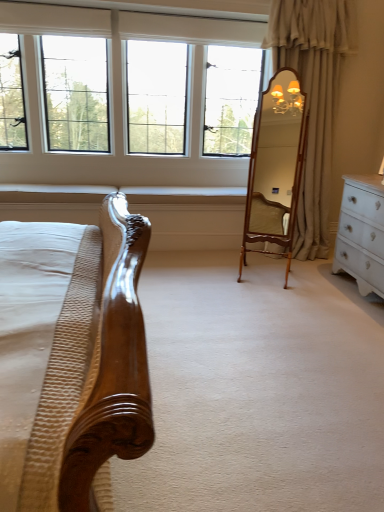
This screenshot has width=384, height=512. What are the coordinates of `clear glass windows at upper center` in the screenshot? It's located at (121, 99).

Find the location of a particular element. clear glass windows at upper center is located at coordinates (121, 99).

Is wooden mirror at center directly adjacent to clear glass windows at upper center?

wooden mirror at center and clear glass windows at upper center are clearly separated.

Considering the relative sizes of wooden mirror at center and clear glass windows at upper center in the image provided, is wooden mirror at center bigger than clear glass windows at upper center?

Incorrect, wooden mirror at center is not larger than clear glass windows at upper center.

From a real-world perspective, who is located higher, wooden mirror at center or clear glass windows at upper center?

clear glass windows at upper center.

Choose the correct answer: Is wooden mirror at center inside clear glass windows at upper center or outside it?

wooden mirror at center is spatially situated outside clear glass windows at upper center.

From the picture: Could you tell me if beige fabric curtain at right is facing clear glass windows at upper center?

No, beige fabric curtain at right is not turned towards clear glass windows at upper center.

From the picture: Between beige fabric curtain at right and clear glass windows at upper center, which one appears on the left side from the viewer's perspective?

clear glass windows at upper center is more to the left.

Considering the relative sizes of beige fabric curtain at right and clear glass windows at upper center in the image provided, is beige fabric curtain at right bigger than clear glass windows at upper center?

Actually, beige fabric curtain at right might be smaller than clear glass windows at upper center.

From a real-world perspective, is beige fabric curtain at right under clear glass windows at upper center?

Yes, from a real-world perspective, beige fabric curtain at right is beneath clear glass windows at upper center.

Image resolution: width=384 pixels, height=512 pixels. Find the location of `mirror in front of the beige fabric curtain at right`. mirror in front of the beige fabric curtain at right is located at coordinates tap(275, 166).

Does point (254, 208) lie in front of point (270, 26)?

No, it is behind (270, 26).

Is wooden mirror at center situated inside beige fabric curtain at right or outside?

wooden mirror at center is located beyond the bounds of beige fabric curtain at right.

Between wooden mirror at center and beige fabric curtain at right, which one has larger size?

beige fabric curtain at right is bigger.

From the image's perspective, which is below, beige fabric curtain at right or wooden mirror at center?

wooden mirror at center, from the image's perspective.

Between beige fabric curtain at right and wooden mirror at center, which one appears on the left side from the viewer's perspective?

wooden mirror at center is more to the left.

Is beige fabric curtain at right thinner than wooden mirror at center?

No.

From a real-world perspective, is beige fabric curtain at right below wooden mirror at center?

No, from a real-world perspective, beige fabric curtain at right is not below wooden mirror at center.

Relative to beige fabric curtain at right, is clear glass windows at upper center in front or behind?

clear glass windows at upper center is positioned farther from the viewer than beige fabric curtain at right.

From the image's perspective, is clear glass windows at upper center above beige fabric curtain at right?

Yes, from the image's perspective, clear glass windows at upper center is above beige fabric curtain at right.

Is beige fabric curtain at right at the back of clear glass windows at upper center?

No, clear glass windows at upper center is not facing the opposite direction of beige fabric curtain at right.

Considering the positions of objects clear glass windows at upper center and beige fabric curtain at right in the image provided, who is more to the left, clear glass windows at upper center or beige fabric curtain at right?

clear glass windows at upper center.

At what (x,y) coordinates should I click in order to perform the action: click on mirror below the clear glass windows at upper center (from the image's perspective). Please return your answer as a coordinate pair (x, y). This screenshot has height=512, width=384. Looking at the image, I should click on (275, 166).

Is clear glass windows at upper center positioned in front of wooden mirror at center?

No, clear glass windows at upper center is further to the viewer.

Who is taller, clear glass windows at upper center or wooden mirror at center?

wooden mirror at center is taller.

In the scene shown: Is wooden mirror at center at the back of clear glass windows at upper center?

No, clear glass windows at upper center's orientation is not away from wooden mirror at center.

This screenshot has width=384, height=512. There is a wooden mirror at center. What are the coordinates of `window above it (from a real-world perspective)` in the screenshot? It's located at (121, 99).

Locate an element on the screen. This screenshot has height=512, width=384. curtain lying on the right of clear glass windows at upper center is located at coordinates (313, 99).

Based on their spatial positions, is wooden mirror at center or beige fabric curtain at right further from clear glass windows at upper center?

wooden mirror at center is further to clear glass windows at upper center.

Estimate the real-world distances between objects in this image. Which object is closer to beige fabric curtain at right, wooden mirror at center or clear glass windows at upper center?

wooden mirror at center is positioned closer to the anchor beige fabric curtain at right.

In the scene shown: When comparing their distances from wooden mirror at center, does beige fabric curtain at right or clear glass windows at upper center seem further?

Among the two, clear glass windows at upper center is located further to wooden mirror at center.

Based on their spatial positions, is beige fabric curtain at right or wooden mirror at center closer to clear glass windows at upper center?

The object closer to clear glass windows at upper center is beige fabric curtain at right.

Considering their positions, is clear glass windows at upper center positioned further to wooden mirror at center than beige fabric curtain at right?

clear glass windows at upper center is further to wooden mirror at center.

Estimate the real-world distances between objects in this image. Which object is further from beige fabric curtain at right, clear glass windows at upper center or wooden mirror at center?

clear glass windows at upper center.

What are the coordinates of `mirror between clear glass windows at upper center and beige fabric curtain at right from left to right` in the screenshot? It's located at (275, 166).